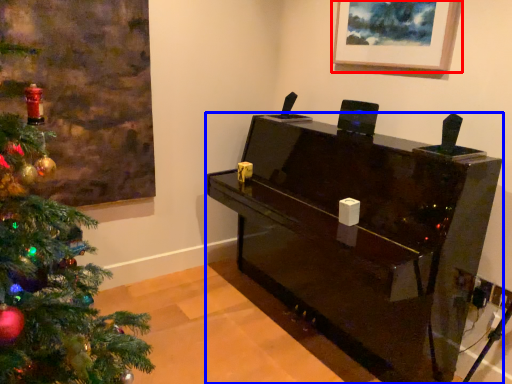
Question: Which object appears closest to the camera in this image, picture frame (highlighted by a red box) or furniture (highlighted by a blue box)?

Choices:
 (A) picture frame
 (B) furniture

Answer: (B)